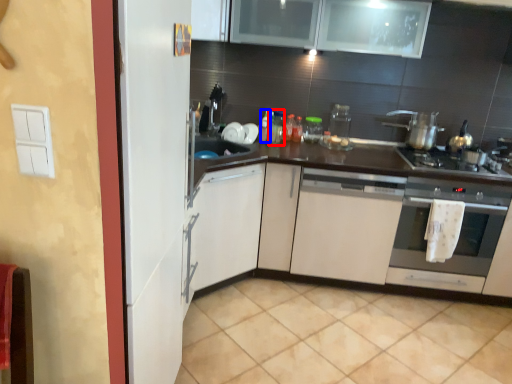
Question: Which object appears farthest to the camera in this image, bottle (highlighted by a red box) or bottle (highlighted by a blue box)?

Choices:
 (A) bottle
 (B) bottle

Answer: (A)